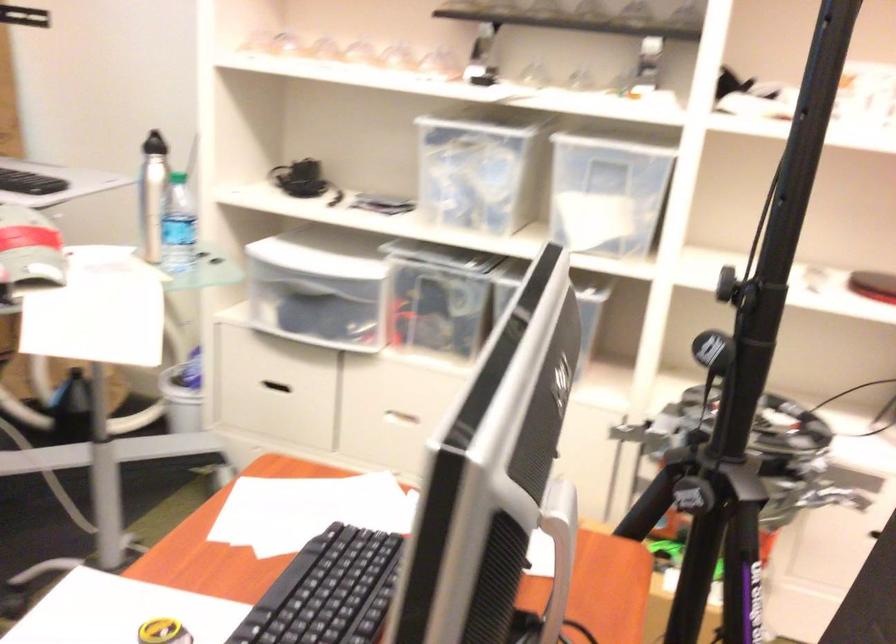
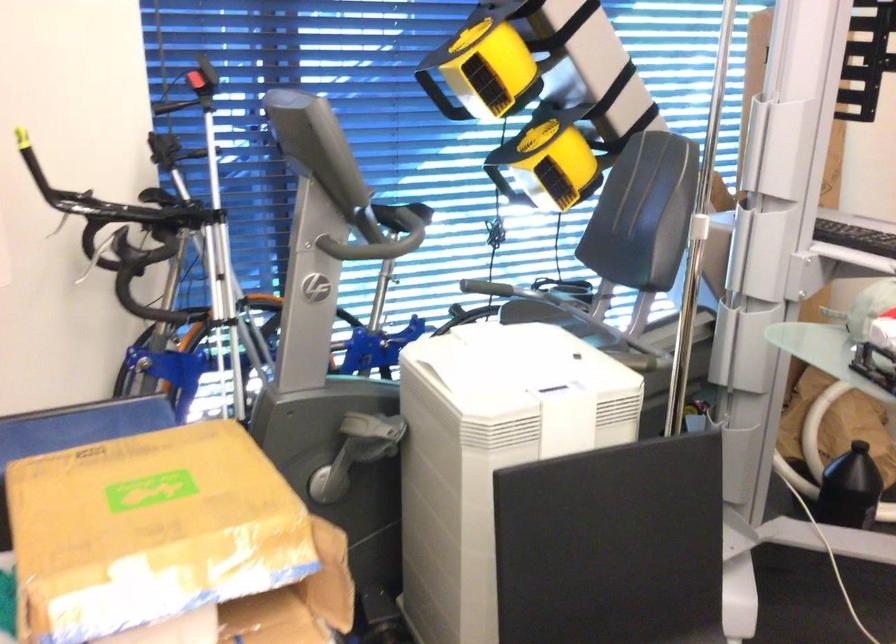
Question: The camera is either moving clockwise (left) or counter-clockwise (right) around the object. The first image is from the beginning of the video and the second image is from the end. Is the camera moving left or right when shooting the video?

Choices:
 (A) Left
 (B) Right

Answer: (B)